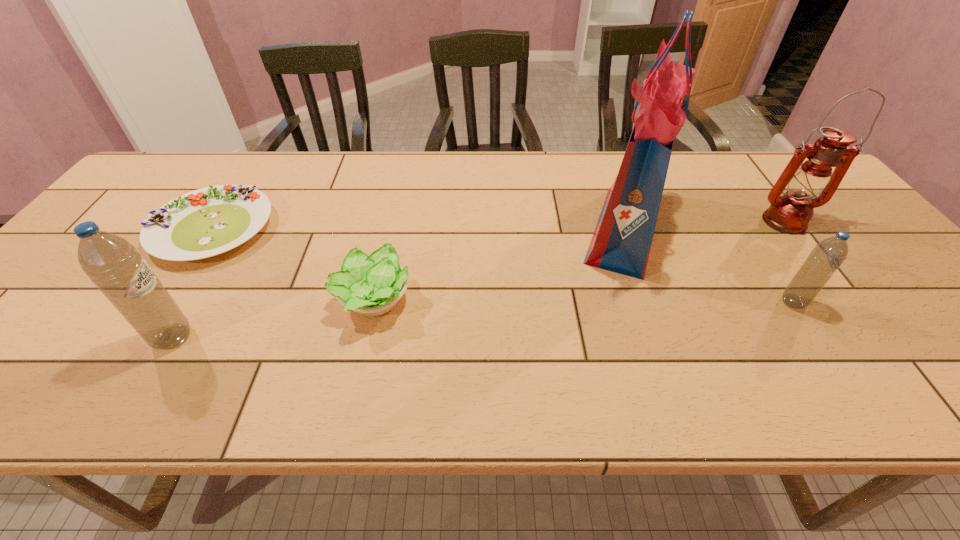
Locate an element on the screen. Image resolution: width=960 pixels, height=540 pixels. free point between the salad plate and the rightmost object is located at coordinates (498, 225).

Find the location of a particular element. The image size is (960, 540). the fifth closest object to the fifth shortest object is located at coordinates (113, 264).

Identify the location of object that is the closest to the third object from right to left. (827, 256).

Where is `vacant space that satisfies the following two spatial constraints: 1. on the front-facing side of the grocery bag; 2. on the front side of the second shortest object`? vacant space that satisfies the following two spatial constraints: 1. on the front-facing side of the grocery bag; 2. on the front side of the second shortest object is located at coordinates (650, 301).

Locate an element on the screen. Image resolution: width=960 pixels, height=540 pixels. vacant space that satisfies the following two spatial constraints: 1. on the front side of the shortest object; 2. on the left side of the fourth shortest object is located at coordinates (141, 338).

The width and height of the screenshot is (960, 540). In order to click on free location that satisfies the following two spatial constraints: 1. on the front side of the shorter water bottle; 2. on the left side of the third object from left to right in this screenshot , I will do `click(373, 302)`.

Locate an element on the screen. The width and height of the screenshot is (960, 540). free space that satisfies the following two spatial constraints: 1. on the front-facing side of the grocery bag; 2. on the right side of the farther water bottle is located at coordinates (651, 302).

At what (x,y) coordinates should I click in order to perform the action: click on free spot that satisfies the following two spatial constraints: 1. on the back side of the second shortest object; 2. on the right side of the taller water bottle. Please return your answer as a coordinate pair (x, y). Image resolution: width=960 pixels, height=540 pixels. Looking at the image, I should click on (195, 301).